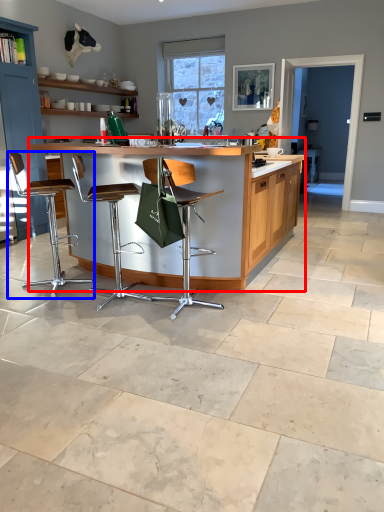
Question: Among these objects, which one is farthest to the camera, table (highlighted by a red box) or chair (highlighted by a blue box)?

Choices:
 (A) table
 (B) chair

Answer: (B)